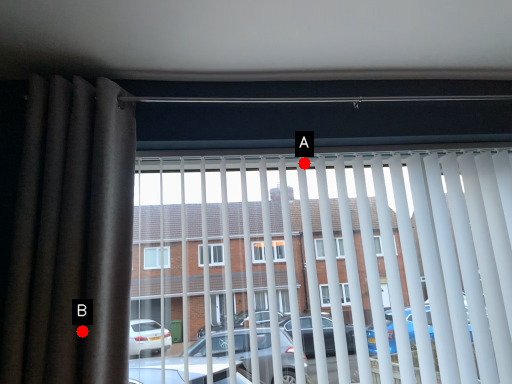
Question: Two points are circled on the image, labeled by A and B beside each circle. Which point is farther to the camera?

Choices:
 (A) A is further
 (B) B is further

Answer: (A)